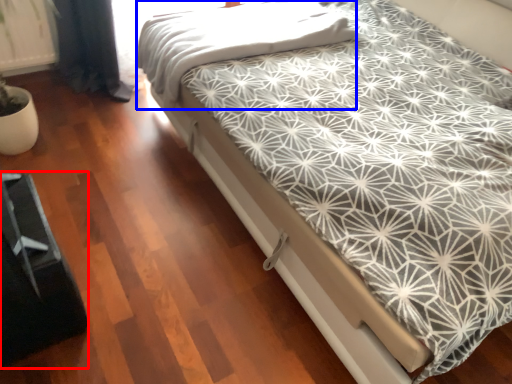
Question: Which point is closer to the camera, bed frame (highlighted by a red box) or blanket (highlighted by a blue box)?

Choices:
 (A) bed frame
 (B) blanket

Answer: (A)